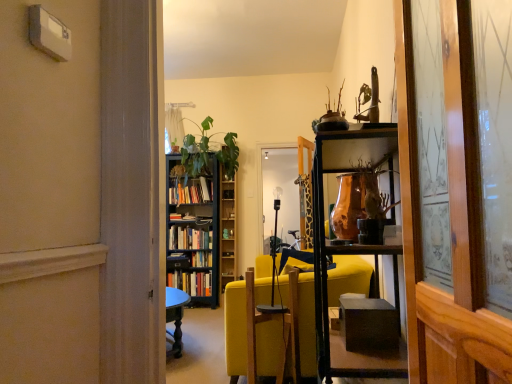
What do you see at coordinates (348, 206) in the screenshot? I see `copper metallic vase at center` at bounding box center [348, 206].

The width and height of the screenshot is (512, 384). Identify the location of green matte bookshelf at center. (227, 229).

Find the location of `hardcover books at center, positioned as the second book in bottom-to-top order`. hardcover books at center, positioned as the second book in bottom-to-top order is located at coordinates (189, 238).

Measure the distance between point (194, 194) and camera.

They are 5.47 meters apart.

The image size is (512, 384). In order to click on wooden swivel chair at center in this screenshot , I will do `click(282, 333)`.

I want to click on copper metallic vase at center, so click(348, 206).

From a real-world perspective, is green leafy plant at center above or below black wooden bookcase at center?

Clearly, from a real-world perspective, green leafy plant at center is above black wooden bookcase at center.

Is green leafy plant at center positioned with its back to black wooden bookcase at center?

Correct, green leafy plant at center is looking away from black wooden bookcase at center.

Can you tell me how much green leafy plant at center and black wooden bookcase at center differ in facing direction?

green leafy plant at center and black wooden bookcase at center are facing 0.219 degrees away from each other.

Between green leafy plant at center and black wooden bookcase at center, which one has larger size?

green leafy plant at center.

Which object is thinner, wooden swivel chair at center or black wooden bookcase at center?

wooden swivel chair at center is thinner.

Which is behind, point (295, 285) or point (219, 209)?

Positioned behind is point (219, 209).

Is wooden swivel chair at center not within black wooden bookcase at center?

Absolutely, wooden swivel chair at center is external to black wooden bookcase at center.

From a real-world perspective, is wooden swivel chair at center located beneath black wooden bookcase at center?

Correct, in the physical world, wooden swivel chair at center is lower than black wooden bookcase at center.

Does point (256, 274) lie behind point (198, 276)?

No.

From the picture: Considering the positions of objects yellow fabric couch at center and hardcover books at center, the first book from the bottom, in the image provided, who is more to the right, yellow fabric couch at center or hardcover books at center, the first book from the bottom,?

yellow fabric couch at center is more to the right.

Considering the sizes of yellow fabric couch at center and hardcover books at center, which is counted as the third book, starting from the top, in the image, is yellow fabric couch at center wider or thinner than hardcover books at center, which is counted as the third book, starting from the top,?

Clearly, yellow fabric couch at center has more width compared to hardcover books at center, which is counted as the third book, starting from the top.

Does yellow fabric couch at center turn towards hardcover books at center, the first book from the bottom?

No, yellow fabric couch at center is not turned towards hardcover books at center, the first book from the bottom.

From a real-world perspective, is green leafy plant at center below hardcover books at center, the first book from the bottom?

No, from a real-world perspective, green leafy plant at center is not beneath hardcover books at center, the first book from the bottom.

Which of these two, green leafy plant at center or hardcover books at center, which is counted as the third book, starting from the top, is smaller?

hardcover books at center, which is counted as the third book, starting from the top.

From the picture: Considering the sizes of objects green leafy plant at center and hardcover books at center, which is counted as the third book, starting from the top, in the image provided, who is shorter, green leafy plant at center or hardcover books at center, which is counted as the third book, starting from the top,?

hardcover books at center, which is counted as the third book, starting from the top, is shorter.

Consider the image. Could you tell me if green leafy plant at center is turned towards hardcover books at center, which is counted as the third book, starting from the top?

No, green leafy plant at center does not turn towards hardcover books at center, which is counted as the third book, starting from the top.

Is black wooden bookcase at center shorter than hardcover books at center, the 2th book in the top-to-bottom sequence?

No.

Visually, is black wooden bookcase at center positioned to the left or to the right of hardcover books at center, the 2th book in the top-to-bottom sequence?

black wooden bookcase at center is to the right of hardcover books at center, the 2th book in the top-to-bottom sequence.

Would you say black wooden bookcase at center is a long distance from hardcover books at center, positioned as the second book in bottom-to-top order?

No, black wooden bookcase at center is in close proximity to hardcover books at center, positioned as the second book in bottom-to-top order.

In the image, is wooden swivel chair at center positioned in front of or behind copper metallic vase at center?

In the image, wooden swivel chair at center appears behind copper metallic vase at center.

Is wooden swivel chair at center not near copper metallic vase at center?

No, wooden swivel chair at center is not far from copper metallic vase at center.

From a real-world perspective, is wooden swivel chair at center physically below copper metallic vase at center?

Indeed, from a real-world perspective, wooden swivel chair at center is positioned beneath copper metallic vase at center.

Based on the photo, from a real-world perspective, is green matte bookshelf at center physically located above or below yellow fabric couch at center?

Clearly, from a real-world perspective, green matte bookshelf at center is above yellow fabric couch at center.

In terms of height, does green matte bookshelf at center look taller or shorter compared to yellow fabric couch at center?

Considering their sizes, green matte bookshelf at center has more height than yellow fabric couch at center.

Is there a large distance between green matte bookshelf at center and yellow fabric couch at center?

Indeed, green matte bookshelf at center is not near yellow fabric couch at center.

Is yellow fabric couch at center a part of green matte bookshelf at center?

No, yellow fabric couch at center is not surrounded by green matte bookshelf at center.

At what (x,y) coordinates should I click in order to perform the action: click on bookcase behind the green leafy plant at center. Please return your answer as a coordinate pair (x, y). Image resolution: width=512 pixels, height=384 pixels. Looking at the image, I should click on (194, 230).

The height and width of the screenshot is (384, 512). In order to click on swivel chair below the black wooden bookcase at center (from the image's perspective) in this screenshot , I will do `click(282, 333)`.

Based on their spatial positions, is hardcover books at center, which is the 3th book from bottom to top, or yellow fabric couch at center closer to black wooden bookcase at center?

Among the two, hardcover books at center, which is the 3th book from bottom to top, is located nearer to black wooden bookcase at center.

When comparing their distances from hardcover books at center, which is counted as the third book, starting from the top, does hardcover books at center, which is the 3th book from bottom to top, or green matte bookshelf at center seem further?

hardcover books at center, which is the 3th book from bottom to top, is further to hardcover books at center, which is counted as the third book, starting from the top.

Based on the photo, when comparing their distances from hardcover books at center, marked as the first book in a top-to-bottom arrangement, does green leafy plant at center or black wooden bookcase at center seem further?

black wooden bookcase at center is further to hardcover books at center, marked as the first book in a top-to-bottom arrangement.

Looking at the image, which one is located further to wooden swivel chair at center, hardcover books at center, positioned as the second book in bottom-to-top order, or yellow fabric couch at center?

Among the two, hardcover books at center, positioned as the second book in bottom-to-top order, is located further to wooden swivel chair at center.

Which object lies nearer to the anchor point wooden swivel chair at center, yellow fabric couch at center or copper metallic vase at center?

Among the two, yellow fabric couch at center is located nearer to wooden swivel chair at center.

Based on their spatial positions, is black wooden bookcase at center or copper metallic vase at center closer to green matte bookshelf at center?

black wooden bookcase at center.

From the image, which object appears to be farther from hardcover books at center, which is counted as the third book, starting from the top, green leafy plant at center or wooden swivel chair at center?

wooden swivel chair at center.

From the image, which object appears to be nearer to green leafy plant at center, black wooden bookcase at center or wooden swivel chair at center?

The object closer to green leafy plant at center is black wooden bookcase at center.

The image size is (512, 384). I want to click on studio couch between copper metallic vase at center and hardcover books at center, which is counted as the third book, starting from the top, from front to back, so click(x=234, y=329).

The height and width of the screenshot is (384, 512). In order to click on bookcase located between copper metallic vase at center and hardcover books at center, marked as the first book in a top-to-bottom arrangement, in the depth direction in this screenshot , I will do `click(194, 230)`.

You are a GUI agent. You are given a task and a screenshot of the screen. Output one action in this format:
    pyautogui.click(x=<x>, y=<y>)
    Task: Click on the bookcase located between wooden swivel chair at center and green matte bookshelf at center in the depth direction
    
    Given the screenshot: What is the action you would take?
    pyautogui.click(x=194, y=230)

Identify the location of studio couch positioned between copper metallic vase at center and hardcover books at center, positioned as the second book in bottom-to-top order, from near to far. This screenshot has width=512, height=384. (234, 329).